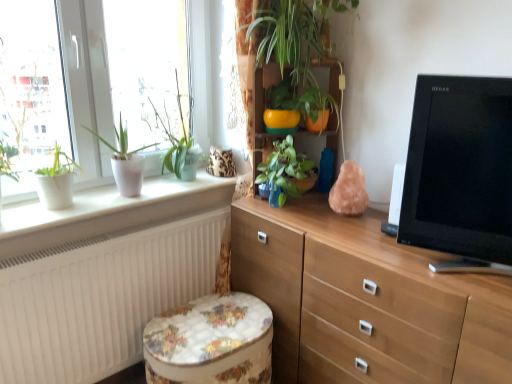
In order to click on clear glass window at upper left in this screenshot , I will do `click(30, 92)`.

You are a GUI agent. You are given a task and a screenshot of the screen. Output one action in this format:
    pyautogui.click(x=<x>, y=<y>)
    Task: Click on the green leafy plant at upper center, the 1th houseplant positioned from the right
    This screenshot has width=512, height=384.
    Given the screenshot: What is the action you would take?
    pyautogui.click(x=293, y=47)

In terms of height, does white glossy window at upper left look taller or shorter compared to white matte radiator at lower left?

white glossy window at upper left is taller than white matte radiator at lower left.

In the scene shown: Between white glossy window at upper left and white matte radiator at lower left, which one appears on the right side from the viewer's perspective?

From the viewer's perspective, white glossy window at upper left appears more on the right side.

Locate an element on the screen. This screenshot has width=512, height=384. radiator behind the white glossy window at upper left is located at coordinates (100, 298).

From the image's perspective, does white glossy window at upper left appear lower than white matte radiator at lower left?

No.

Does clear glass window at upper left touch green glossy plant at center, the 2th houseplant positioned from the right?

No, clear glass window at upper left is not touching green glossy plant at center, the 2th houseplant positioned from the right.

Is green glossy plant at center, the 3th houseplant positioned from the left, inside clear glass window at upper left?

No.

Is point (35, 73) positioned before point (291, 136)?

That is True.

Consider the image. From a real-world perspective, is clear glass window at upper left positioned above or below green glossy plant at center, the 3th houseplant positioned from the left?

clear glass window at upper left is situated higher than green glossy plant at center, the 3th houseplant positioned from the left, in the real world.

Who is shorter, green glossy plant at center, the 3th houseplant positioned from the left, or floral fabric ottoman at lower center?

green glossy plant at center, the 3th houseplant positioned from the left, is shorter.

Is green glossy plant at center, the 2th houseplant positioned from the right, beside floral fabric ottoman at lower center?

green glossy plant at center, the 2th houseplant positioned from the right, is not next to floral fabric ottoman at lower center, and they're not touching.

Based on the photo, what's the angular difference between green glossy plant at center, the 2th houseplant positioned from the right, and floral fabric ottoman at lower center's facing directions?

79.5 degrees separate the facing orientations of green glossy plant at center, the 2th houseplant positioned from the right, and floral fabric ottoman at lower center.

Is point (312, 163) in front of point (212, 309)?

No, (312, 163) is behind (212, 309).

Is clear glass window at upper left smaller than light brown wood chest of drawers at center?

Yes, clear glass window at upper left is smaller than light brown wood chest of drawers at center.

How much distance is there between clear glass window at upper left and light brown wood chest of drawers at center?

The distance of clear glass window at upper left from light brown wood chest of drawers at center is 1.15 meters.

Consider the image. From the image's perspective, which is below, clear glass window at upper left or light brown wood chest of drawers at center?

From the image's view, light brown wood chest of drawers at center is below.

Does clear glass window at upper left turn towards light brown wood chest of drawers at center?

No, clear glass window at upper left is not facing towards light brown wood chest of drawers at center.

Consider the image. Is white matte radiator at lower left spatially inside white glossy window sill at left, or outside of it?

white matte radiator at lower left exists outside the volume of white glossy window sill at left.

In the scene shown: Can you tell me how much white matte radiator at lower left and white glossy window sill at left differ in facing direction?

They differ by 0.437 degrees in their facing directions.

From the image's perspective, which one is positioned higher, white matte radiator at lower left or white glossy window sill at left?

white glossy window sill at left appears higher in the image.

Can you confirm if white matte radiator at lower left is wider than white glossy window sill at left?

No.

Which object is wider, wooden cabinet at center or clear glass window at upper left?

Wider between the two is wooden cabinet at center.

Is clear glass window at upper left surrounded by wooden cabinet at center?

No.

From the image's perspective, is wooden cabinet at center on clear glass window at upper left?

Yes.

From a real-world perspective, which object stands above the other?

clear glass window at upper left.

From the image's perspective, would you say white glossy window at upper left is shown under white matte plant pot at left, placed as the 4th houseplant when sorted from right to left?

No.

Is the depth of white glossy window at upper left less than that of white matte plant pot at left, placed as the 4th houseplant when sorted from right to left?

Yes, white glossy window at upper left is closer to the viewer.

From a real-world perspective, which is physically below, white glossy window at upper left or white matte plant pot at left, placed as the 4th houseplant when sorted from right to left?

white matte plant pot at left, placed as the 4th houseplant when sorted from right to left, is physically lower.

Find the location of `window located above the white matte radiator at lower left (from the image's perspective)`. window located above the white matte radiator at lower left (from the image's perspective) is located at coordinates (87, 89).

Locate an element on the screen. The width and height of the screenshot is (512, 384). the 3rd houseplant counting from the right of the clear glass window at upper left is located at coordinates (283, 168).

From the image, which object appears to be farther from green glossy plant at center, the 2th houseplant positioned from the right, white matte plant pot at left, placed as the 4th houseplant when sorted from right to left, or white glossy window at upper left?

white matte plant pot at left, placed as the 4th houseplant when sorted from right to left, lies further to green glossy plant at center, the 2th houseplant positioned from the right, than the other object.

Looking at the image, which one is located closer to light brown wood chest of drawers at center, clear glass window at upper left or white matte radiator at lower left?

white matte radiator at lower left.

Considering their positions, is white glossy window sill at left positioned further to floral fabric ottoman at lower center than white glossy window at upper left?

white glossy window at upper left.

Looking at the image, which one is located further to white glossy window sill at left, white matte radiator at lower left or green glossy plant at center, the 3th houseplant positioned from the left?

green glossy plant at center, the 3th houseplant positioned from the left, is positioned further to the anchor white glossy window sill at left.

Considering their positions, is matte white pot at left, which ranks as the third houseplant in right-to-left order, positioned closer to wooden cabinet at center than white glossy window at upper left?

Based on the image, matte white pot at left, which ranks as the third houseplant in right-to-left order, appears to be nearer to wooden cabinet at center.

When comparing their distances from clear glass window at upper left, does light brown wood chest of drawers at center or white glossy window sill at left seem further?

light brown wood chest of drawers at center is positioned further to the anchor clear glass window at upper left.

Which object lies nearer to the anchor point white glossy window sill at left, wooden cabinet at center or clear glass window at upper left?

Based on the image, clear glass window at upper left appears to be nearer to white glossy window sill at left.

Which object lies nearer to the anchor point white matte radiator at lower left, matte white pot at left, positioned as the 2th houseplant in left-to-right order, or green leafy plant at upper center, marked as the 4th houseplant in a left-to-right arrangement?

matte white pot at left, positioned as the 2th houseplant in left-to-right order.

This screenshot has width=512, height=384. Find the location of `window sill between white matte radiator at lower left and light brown wood chest of drawers at center in the horizontal direction`. window sill between white matte radiator at lower left and light brown wood chest of drawers at center in the horizontal direction is located at coordinates (100, 203).

Locate an element on the screen. radiator between clear glass window at upper left and black glossy tv at right is located at coordinates (100, 298).

This screenshot has width=512, height=384. In order to click on tv cabinet between clear glass window at upper left and black glossy tv at right from left to right in this screenshot , I will do `click(283, 171)`.

Locate an element on the screen. This screenshot has height=384, width=512. window sill between white glossy window at upper left and white matte radiator at lower left in the vertical direction is located at coordinates (100, 203).